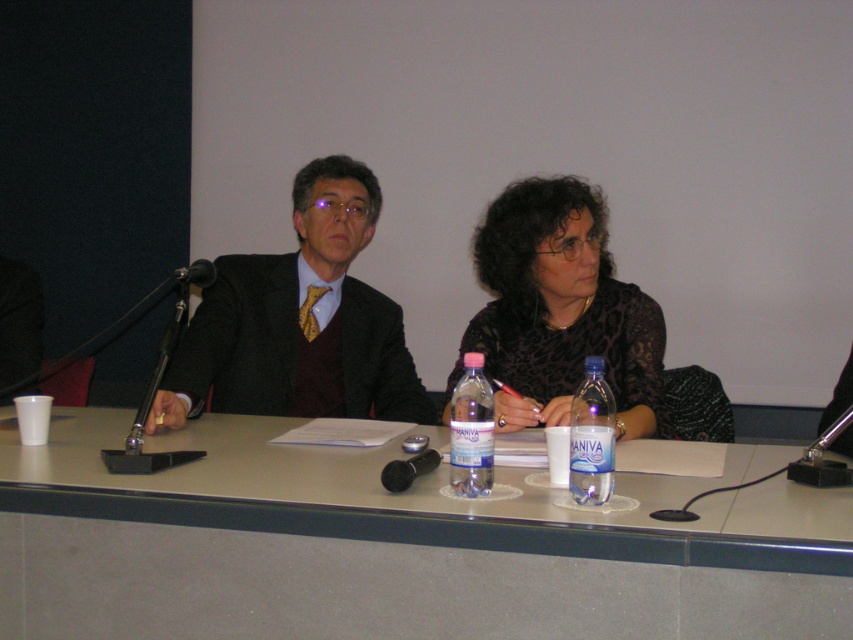
Does point (223, 301) come farther from viewer compared to point (206, 260)?

Yes, it is.

Between dark gray wool suit at left and black metallic microphone at left, which one appears on the right side from the viewer's perspective?

From the viewer's perspective, dark gray wool suit at left appears more on the right side.

Is point (195, 392) positioned after point (184, 268)?

Yes, point (195, 392) is behind point (184, 268).

What are the coordinates of `dark gray wool suit at left` in the screenshot? It's located at (242, 337).

Who is positioned more to the left, translucent plastic water bottle at center or black metallic microphone at left?

black metallic microphone at left

Does translucent plastic water bottle at center have a larger size compared to black metallic microphone at left?

Correct, translucent plastic water bottle at center is larger in size than black metallic microphone at left.

What do you see at coordinates (471, 429) in the screenshot?
I see `translucent plastic water bottle at center` at bounding box center [471, 429].

Locate an element on the screen. The image size is (853, 640). translucent plastic water bottle at center is located at coordinates (471, 429).

Does smooth gray table at center appear on the right side of transparent plastic bottle at center?

Incorrect, smooth gray table at center is not on the right side of transparent plastic bottle at center.

Between point (186, 488) and point (573, 483), which one is positioned in front?

Point (573, 483)

Where is `smooth gray table at center`? Image resolution: width=853 pixels, height=640 pixels. smooth gray table at center is located at coordinates (396, 547).